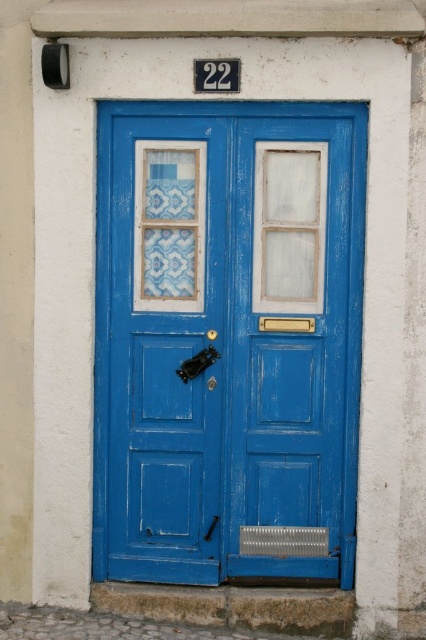
In the scene shown: Is blue painted wood door at center to the left of white frosted glass at center from the viewer's perspective?

Correct, you'll find blue painted wood door at center to the left of white frosted glass at center.

Is blue painted wood door at center below white frosted glass at center?

Yes, blue painted wood door at center is below white frosted glass at center.

Does point (183, 433) come in front of point (265, 227)?

No, (183, 433) is further to viewer.

Where is `blue painted wood door at center`? Image resolution: width=426 pixels, height=640 pixels. blue painted wood door at center is located at coordinates (227, 340).